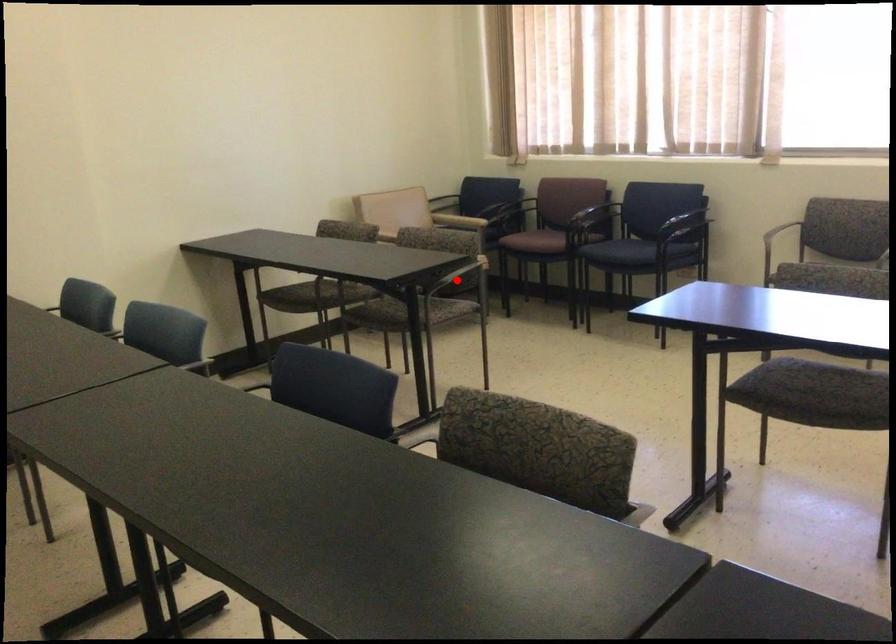
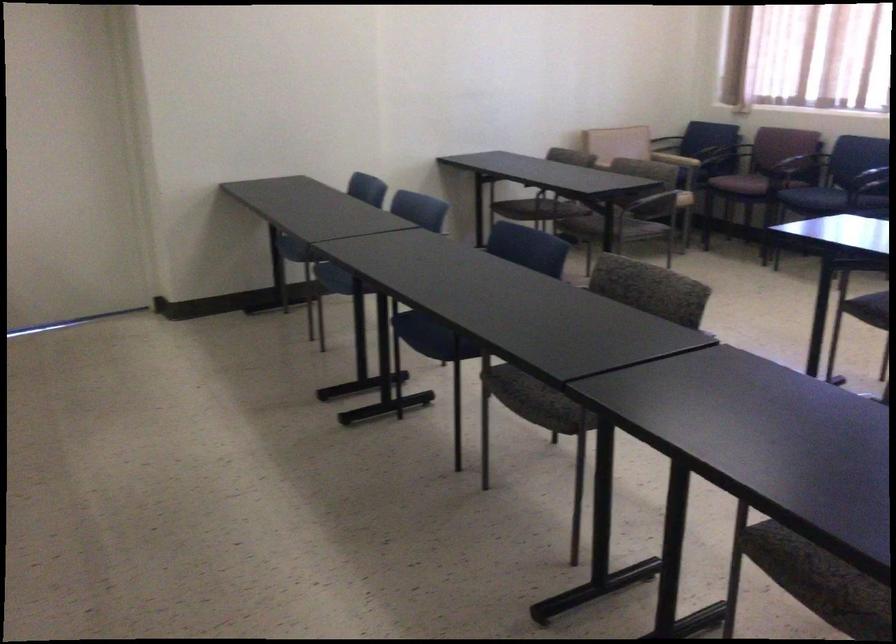
Find the pixel in the second image that matches the highlighted location in the first image.

(655, 204)